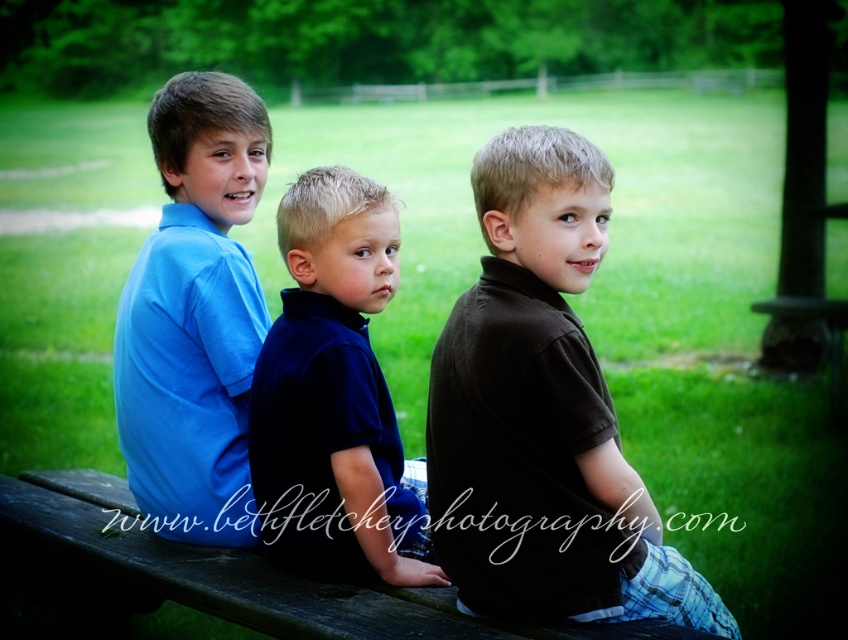
You are a photographer setting up a tripod to take a group photo of the matte blue shirt at center and the dark blue velvety shirt at center. You want to ensure both shirts are fully visible in the frame. Based on their heights, which shirt should you position closer to the front of the group to avoid blocking the other?

The matte blue shirt at center is much taller than the dark blue velvety shirt at center, so you should position the dark blue velvety shirt at center closer to the front to avoid being blocked by the taller matte blue shirt at center.

You are a photographer standing at the center of the field. You want to take a photo of the brown cotton shirt at center. Where should you aim your camera to capture it?

You should aim your camera at point (542, 413) to capture the brown cotton shirt at center.